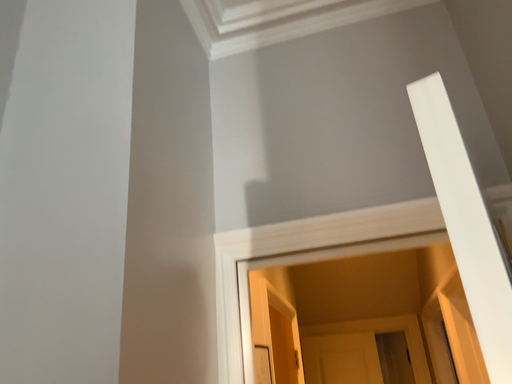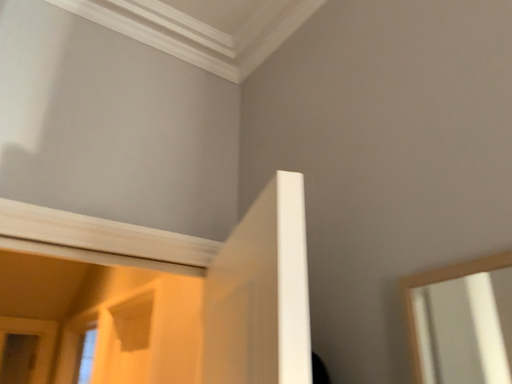
Question: Which way did the camera rotate in the video?

Choices:
 (A) rotated upward
 (B) rotated downward

Answer: (B)